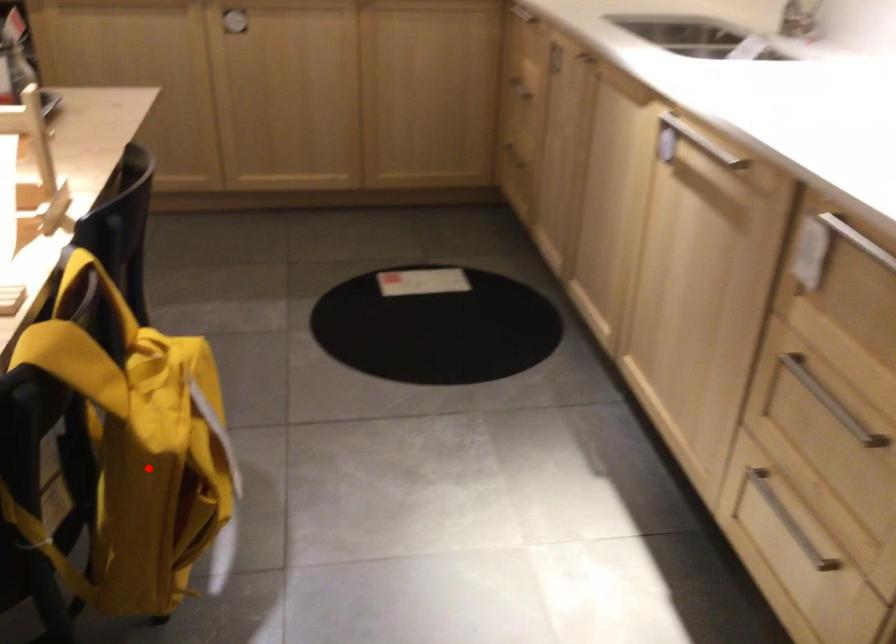
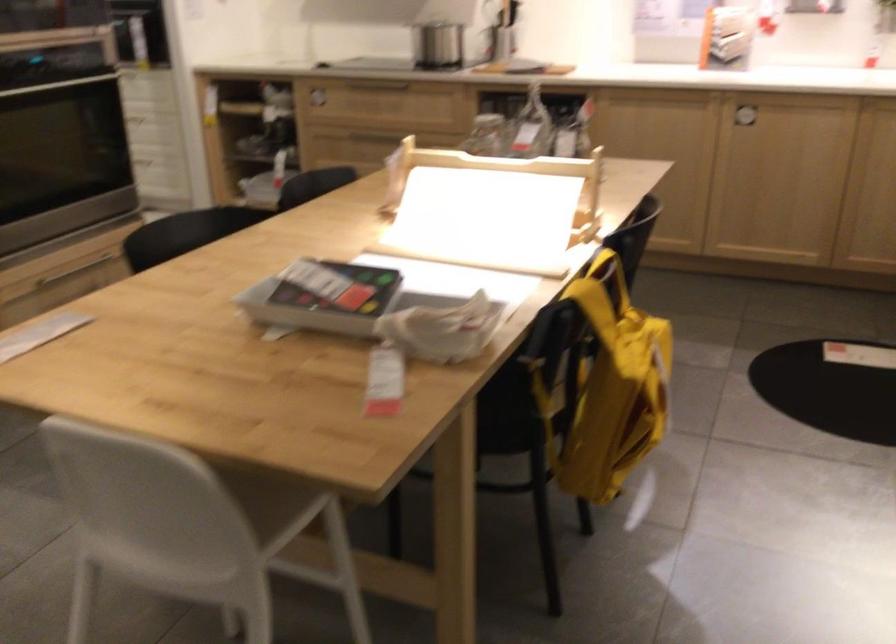
Find the pixel in the second image that matches the highlighted location in the first image.

(609, 386)